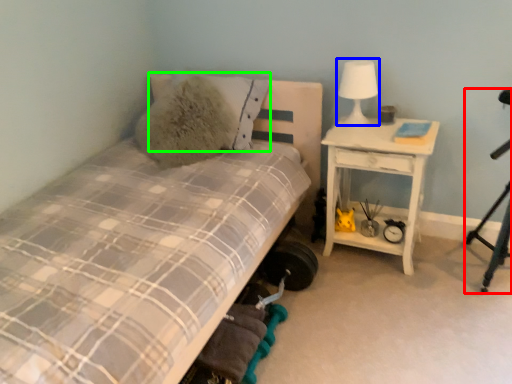
Question: Based on their relative distances, which object is nearer to tripod (highlighted by a red box)? Choose from table lamp (highlighted by a blue box) and pillow (highlighted by a green box).

Choices:
 (A) table lamp
 (B) pillow

Answer: (A)